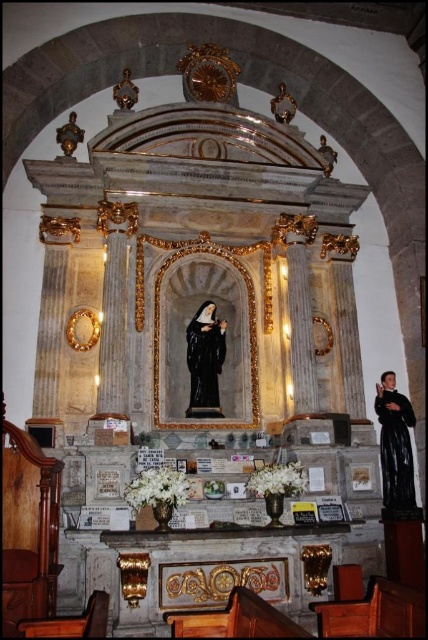
Who is lower down, black matte robe at right or black glossy statue at center?

black matte robe at right

Looking at this image, can you confirm if black matte robe at right is positioned to the left of black glossy statue at center?

In fact, black matte robe at right is to the right of black glossy statue at center.

Locate an element on the screen. The image size is (428, 640). black matte robe at right is located at coordinates pos(395,444).